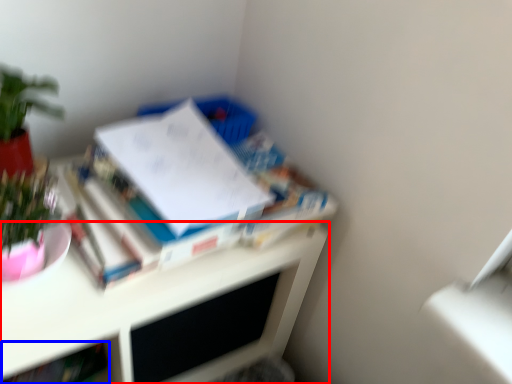
Question: Which object appears closest to the camera in this image, desk (highlighted by a red box) or book (highlighted by a blue box)?

Choices:
 (A) desk
 (B) book

Answer: (A)